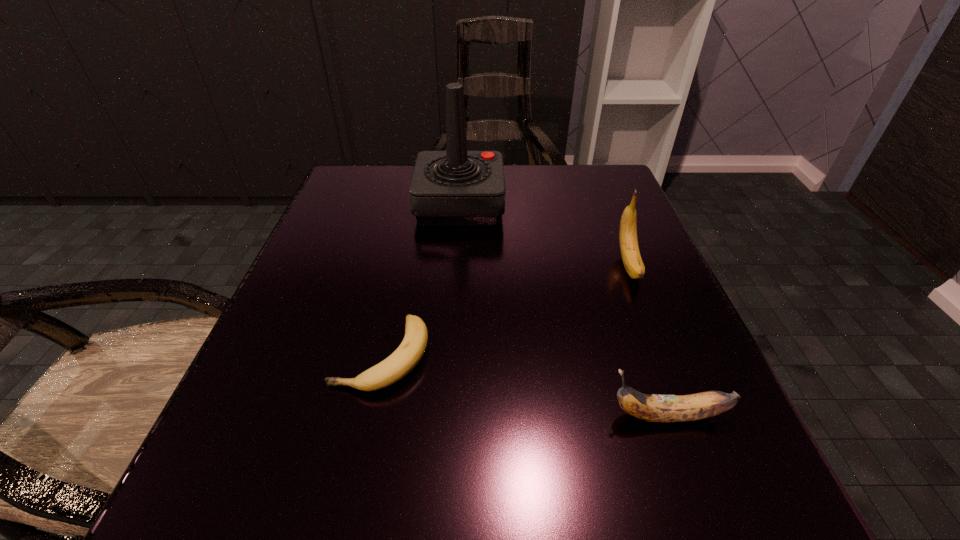
Find the location of a particular element. The image size is (960, 540). blank space at the near left corner is located at coordinates (248, 470).

At what (x,y) coordinates should I click in order to perform the action: click on free space at the far right corner of the desktop. Please return your answer as a coordinate pair (x, y). The image size is (960, 540). Looking at the image, I should click on (593, 194).

This screenshot has height=540, width=960. In order to click on free space between the second tallest banana and the third nearest object in this screenshot , I will do `click(649, 341)`.

I want to click on empty location between the second tallest object and the tallest object, so click(x=544, y=235).

Locate an element on the screen. empty space between the shortest banana and the second farthest object is located at coordinates (505, 310).

The image size is (960, 540). What are the coordinates of `vacant area that lies between the shortest object and the third shortest object` in the screenshot? It's located at (505, 310).

I want to click on vacant space in between the farthest banana and the joystick, so click(x=544, y=235).

Where is `free space between the joystick and the shortest object`? The width and height of the screenshot is (960, 540). free space between the joystick and the shortest object is located at coordinates (420, 280).

This screenshot has height=540, width=960. I want to click on vacant area between the second farthest banana and the tallest object, so click(x=420, y=280).

Find the location of a particular element. This screenshot has width=960, height=540. empty space between the shortest banana and the nearest banana is located at coordinates (524, 386).